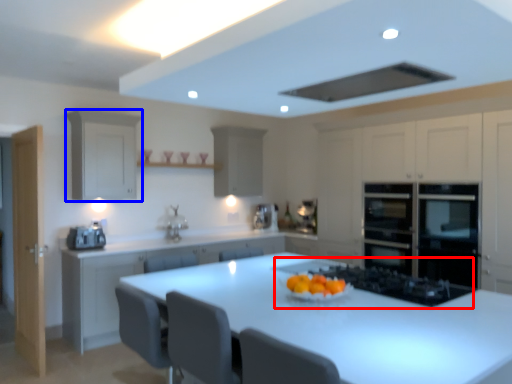
Question: Which object is further to the camera taking this photo, gas stove (highlighted by a red box) or cabinetry (highlighted by a blue box)?

Choices:
 (A) gas stove
 (B) cabinetry

Answer: (B)